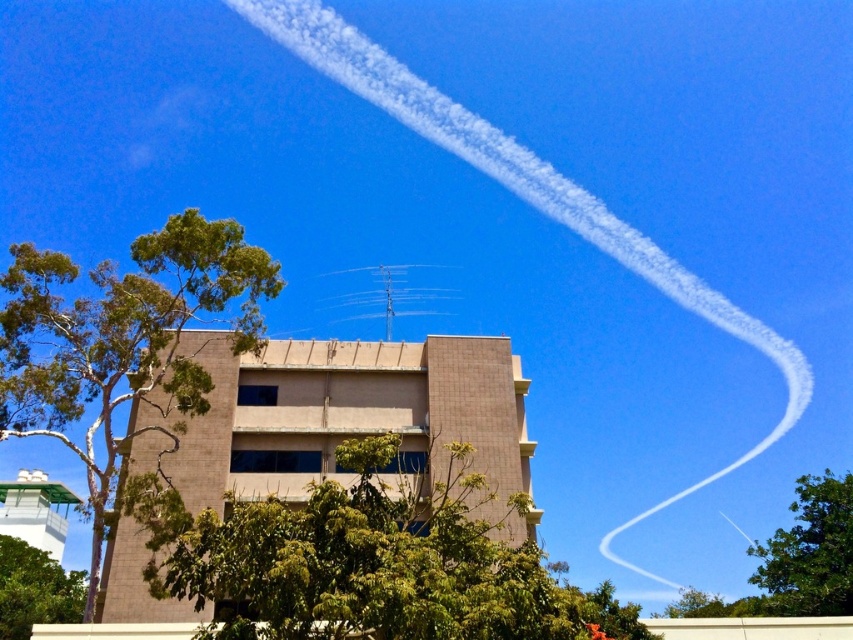
Is point (503, 566) behind point (57, 365)?

No, (503, 566) is in front of (57, 365).

How far apart are green leafy tree at center and green leafy tree at left?

green leafy tree at center is 19.19 feet from green leafy tree at left.

Is point (276, 500) less distant than point (86, 458)?

Yes, it is.

The width and height of the screenshot is (853, 640). In order to click on green leafy tree at center in this screenshot , I will do `click(372, 564)`.

Does green leafy tree at left have a lesser height compared to green leafy tree at lower left?

Incorrect, green leafy tree at left's height does not fall short of green leafy tree at lower left's.

Is point (99, 412) closer to viewer compared to point (9, 557)?

Yes, it is in front of point (9, 557).

Who is more forward, (109, 528) or (33, 604)?

Point (109, 528) is in front.

You are a GUI agent. You are given a task and a screenshot of the screen. Output one action in this format:
    pyautogui.click(x=<x>, y=<y>)
    Task: Click on the green leafy tree at left
    The height and width of the screenshot is (640, 853).
    Given the screenshot: What is the action you would take?
    pyautogui.click(x=123, y=353)

Describe the element at coordinates (123, 353) in the screenshot. I see `green leafy tree at left` at that location.

Can you confirm if green leafy tree at left is positioned to the left of green leafy tree at right?

Yes, green leafy tree at left is to the left of green leafy tree at right.

Is point (38, 300) farther from viewer compared to point (833, 541)?

That is False.

This screenshot has height=640, width=853. In order to click on green leafy tree at left in this screenshot , I will do `click(123, 353)`.